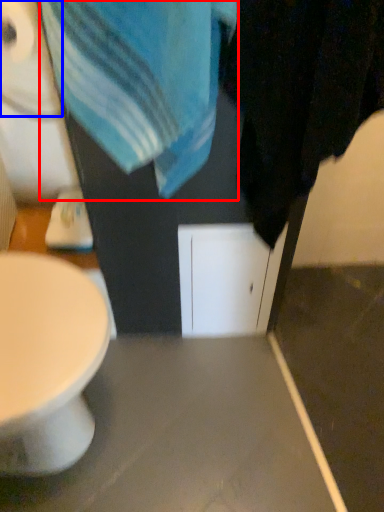
Question: Which object is closer to the camera taking this photo, beach towel (highlighted by a red box) or toilet paper (highlighted by a blue box)?

Choices:
 (A) beach towel
 (B) toilet paper

Answer: (A)